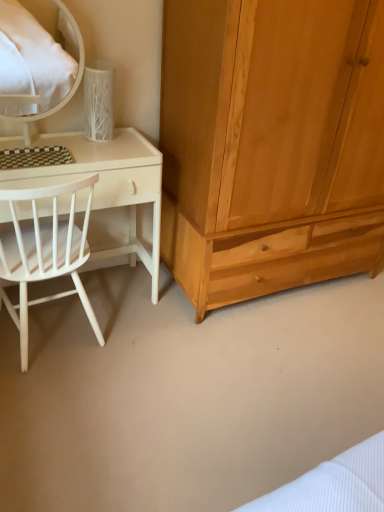
Question: Should I look upward or downward to see white glossy mirror at upper left?

Choices:
 (A) up
 (B) down

Answer: (A)

Question: Is white wood chair at left taller than white matte desk at left?

Choices:
 (A) no
 (B) yes

Answer: (B)

Question: Can you confirm if white wood chair at left is thinner than white matte desk at left?

Choices:
 (A) no
 (B) yes

Answer: (A)

Question: Is white matte desk at left at the back of white wood chair at left?

Choices:
 (A) no
 (B) yes

Answer: (B)

Question: Is white wood chair at left shorter than white matte desk at left?

Choices:
 (A) yes
 (B) no

Answer: (B)

Question: From a real-world perspective, is white wood chair at left on white matte desk at left?

Choices:
 (A) yes
 (B) no

Answer: (A)

Question: Can you confirm if white wood chair at left is bigger than white matte desk at left?

Choices:
 (A) no
 (B) yes

Answer: (A)

Question: From the image's perspective, does natural wood wardrobe at right appear lower than white wood chair at left?

Choices:
 (A) yes
 (B) no

Answer: (B)

Question: Is white wood chair at left completely or partially inside natural wood wardrobe at right?

Choices:
 (A) no
 (B) yes

Answer: (A)

Question: Is natural wood wardrobe at right in front of white wood chair at left?

Choices:
 (A) no
 (B) yes

Answer: (A)

Question: Does natural wood wardrobe at right turn towards white wood chair at left?

Choices:
 (A) no
 (B) yes

Answer: (A)

Question: Considering the relative positions of natural wood wardrobe at right and white wood chair at left in the image provided, is natural wood wardrobe at right behind white wood chair at left?

Choices:
 (A) no
 (B) yes

Answer: (B)

Question: Can you confirm if natural wood wardrobe at right is taller than white wood chair at left?

Choices:
 (A) yes
 (B) no

Answer: (A)

Question: Would you say white matte desk at left is outside white wood chair at left?

Choices:
 (A) no
 (B) yes

Answer: (A)